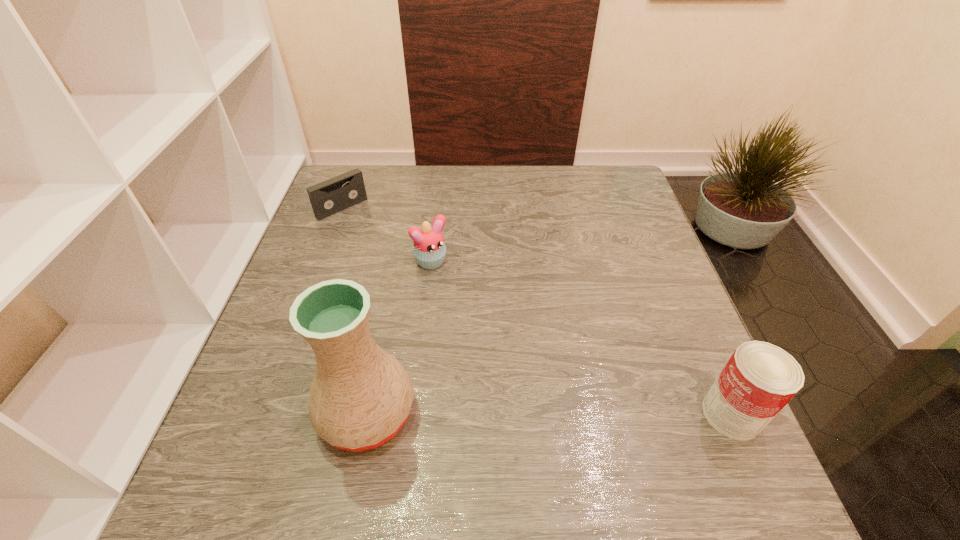
At what (x,y) coordinates should I click in order to perform the action: click on free space that satisfies the following two spatial constraints: 1. on the front side of the can; 2. on the front label of the leftmost object. Please return your answer as a coordinate pair (x, y). This screenshot has width=960, height=540. Looking at the image, I should click on (265, 414).

You are a GUI agent. You are given a task and a screenshot of the screen. Output one action in this format:
    pyautogui.click(x=<x>, y=<y>)
    Task: Click on the free space that satisfies the following two spatial constraints: 1. on the front side of the pottery; 2. on the front label of the rightmost object
    
    Given the screenshot: What is the action you would take?
    (367, 414)

The width and height of the screenshot is (960, 540). I want to click on free space in the image that satisfies the following two spatial constraints: 1. on the front side of the tallest object; 2. on the front label of the rightmost object, so click(367, 414).